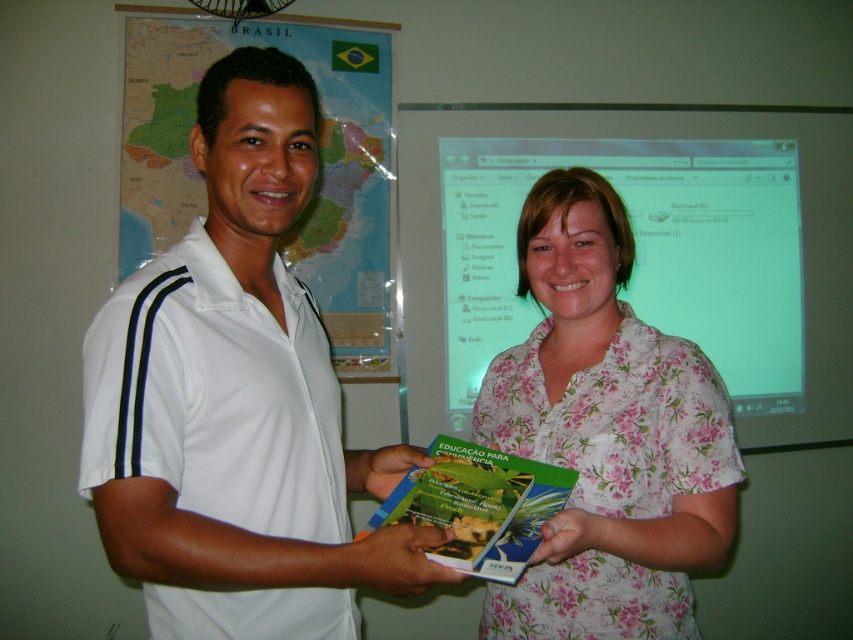
Is white smooth shirt at center to the right of green matte book at center from the viewer's perspective?

In fact, white smooth shirt at center is to the left of green matte book at center.

Does white smooth shirt at center have a larger size compared to green matte book at center?

Correct, white smooth shirt at center is larger in size than green matte book at center.

What do you see at coordinates (236, 400) in the screenshot?
I see `white smooth shirt at center` at bounding box center [236, 400].

I want to click on white smooth shirt at center, so click(x=236, y=400).

Can you confirm if floral fabric shirt at center is thinner than green matte book at center?

No, floral fabric shirt at center is not thinner than green matte book at center.

Is floral fabric shirt at center positioned before green matte book at center?

No.

Does point (634, 524) come behind point (532, 500)?

Yes, it is behind point (532, 500).

Find the location of a particular element. floral fabric shirt at center is located at coordinates pyautogui.click(x=606, y=435).

Describe the element at coordinates (318, 173) in the screenshot. The width and height of the screenshot is (853, 640). I see `map of brazil at upper left` at that location.

Between point (170, 128) and point (468, 468), which one is positioned behind?

Point (170, 128)

Identify the location of map of brazil at upper left. (318, 173).